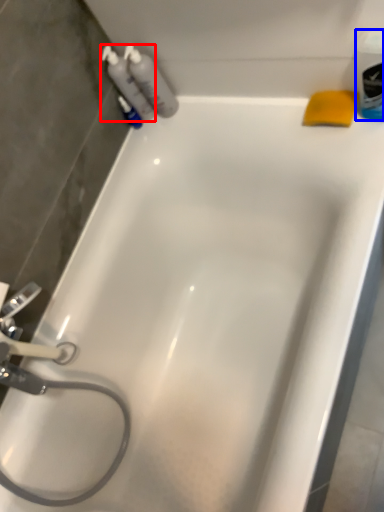
Question: Which point is further to the camera, cleaning product (highlighted by a red box) or mouthwash (highlighted by a blue box)?

Choices:
 (A) cleaning product
 (B) mouthwash

Answer: (A)